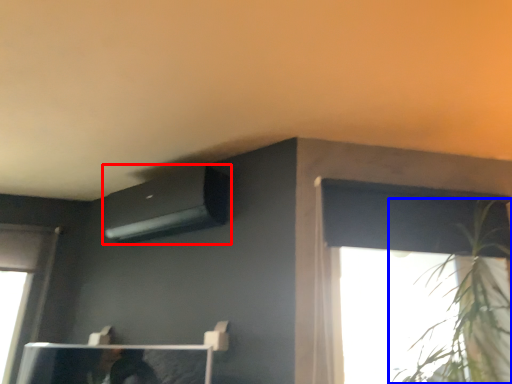
Question: Which object appears farthest to the camera in this image, air conditioning (highlighted by a red box) or houseplant (highlighted by a blue box)?

Choices:
 (A) air conditioning
 (B) houseplant

Answer: (A)